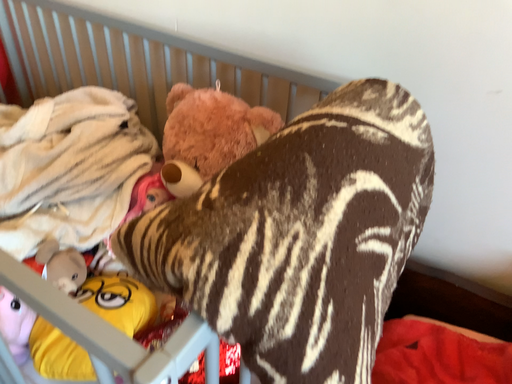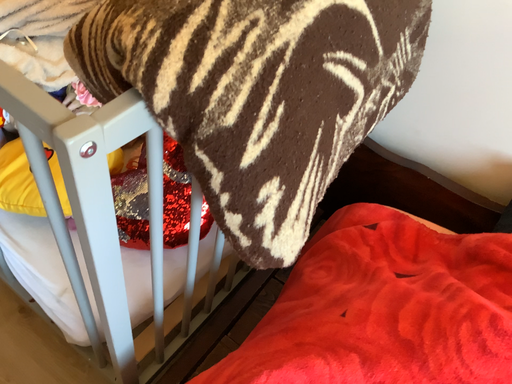
Question: Which way did the camera rotate in the video?

Choices:
 (A) rotated downward
 (B) rotated upward

Answer: (A)